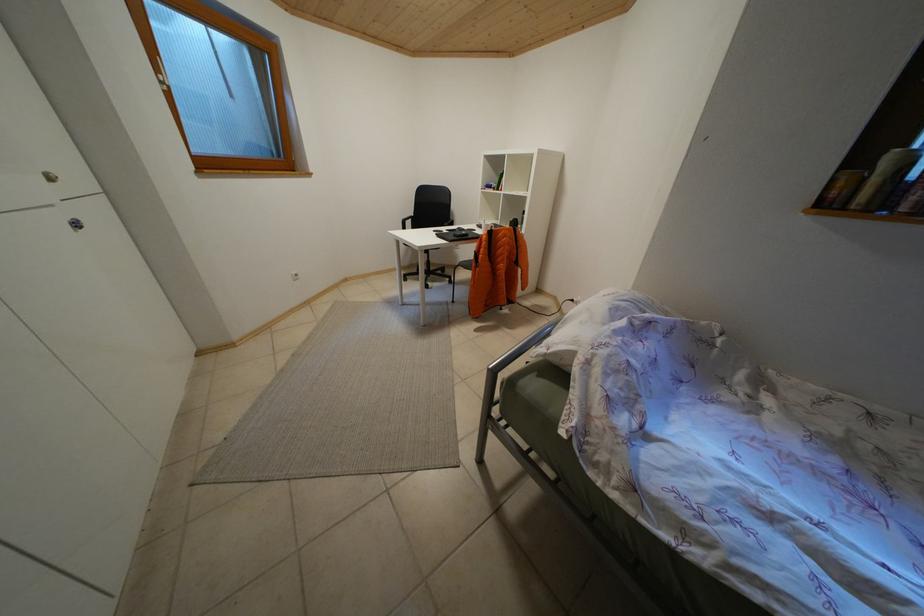
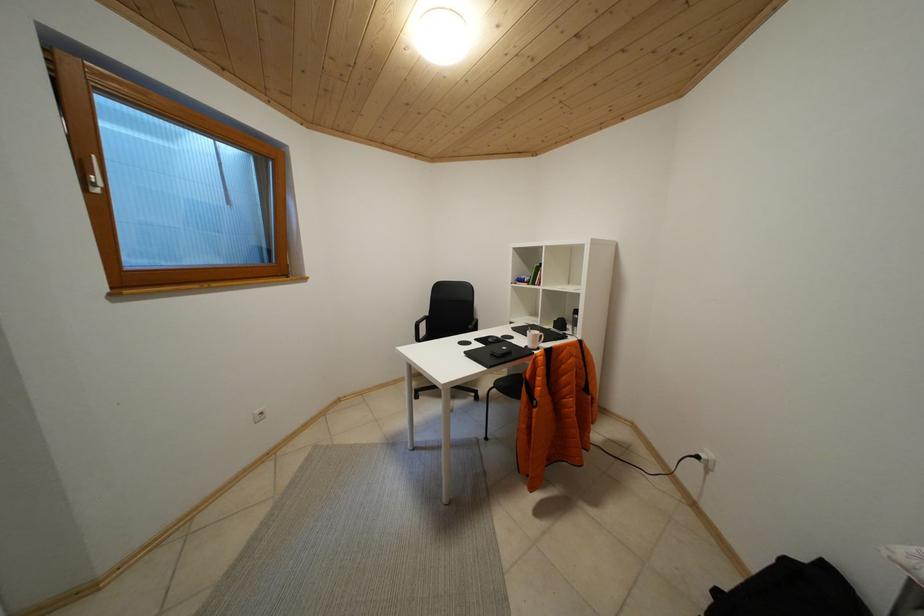
Question: The images are taken continuously from a first-person perspective. In which direction is your viewpoint rotating?

Choices:
 (A) Left
 (B) Right
 (C) Up
 (D) Down

Answer: (C)